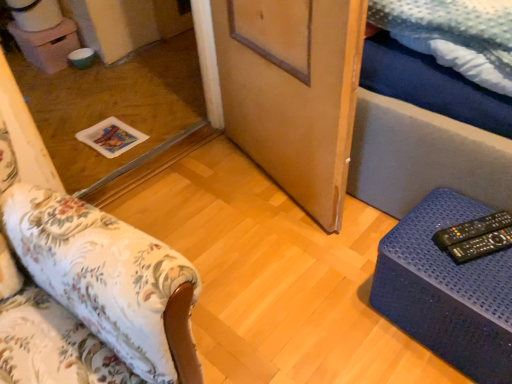
Identify the location of vacant area in front of black plastic remote at lower right, the second remote in the front-to-back sequence. The image size is (512, 384). (483, 280).